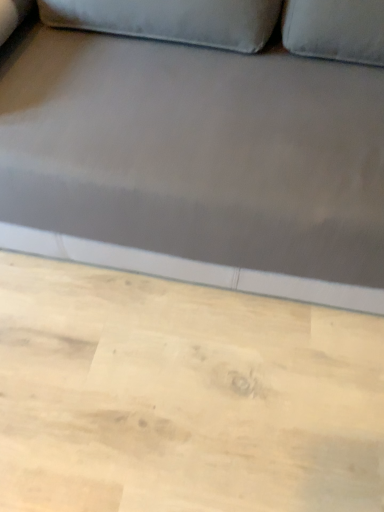
Question: Is light wood plywood at lower center smaller than satin gray fabric couch at center?

Choices:
 (A) no
 (B) yes

Answer: (B)

Question: From a real-world perspective, is light wood plywood at lower center below satin gray fabric couch at center?

Choices:
 (A) yes
 (B) no

Answer: (A)

Question: From the image's perspective, is light wood plywood at lower center above satin gray fabric couch at center?

Choices:
 (A) yes
 (B) no

Answer: (B)

Question: Is light wood plywood at lower center positioned in front of satin gray fabric couch at center?

Choices:
 (A) no
 (B) yes

Answer: (A)

Question: Can you confirm if light wood plywood at lower center is shorter than satin gray fabric couch at center?

Choices:
 (A) yes
 (B) no

Answer: (A)

Question: Is light wood plywood at lower center at the right side of satin gray fabric couch at center?

Choices:
 (A) yes
 (B) no

Answer: (B)

Question: Considering the relative positions of satin gray fabric couch at center and light wood plywood at lower center in the image provided, is satin gray fabric couch at center to the right of light wood plywood at lower center from the viewer's perspective?

Choices:
 (A) no
 (B) yes

Answer: (B)

Question: Is light wood plywood at lower center completely or partially inside satin gray fabric couch at center?

Choices:
 (A) no
 (B) yes

Answer: (A)

Question: Is satin gray fabric couch at center positioned beyond the bounds of light wood plywood at lower center?

Choices:
 (A) no
 (B) yes

Answer: (B)

Question: Can you confirm if satin gray fabric couch at center is smaller than light wood plywood at lower center?

Choices:
 (A) yes
 (B) no

Answer: (B)

Question: Is satin gray fabric couch at center further to the viewer compared to light wood plywood at lower center?

Choices:
 (A) yes
 (B) no

Answer: (B)

Question: From a real-world perspective, is satin gray fabric couch at center located higher than light wood plywood at lower center?

Choices:
 (A) yes
 (B) no

Answer: (A)

Question: Is satin gray fabric couch at center inside or outside of light wood plywood at lower center?

Choices:
 (A) inside
 (B) outside

Answer: (B)